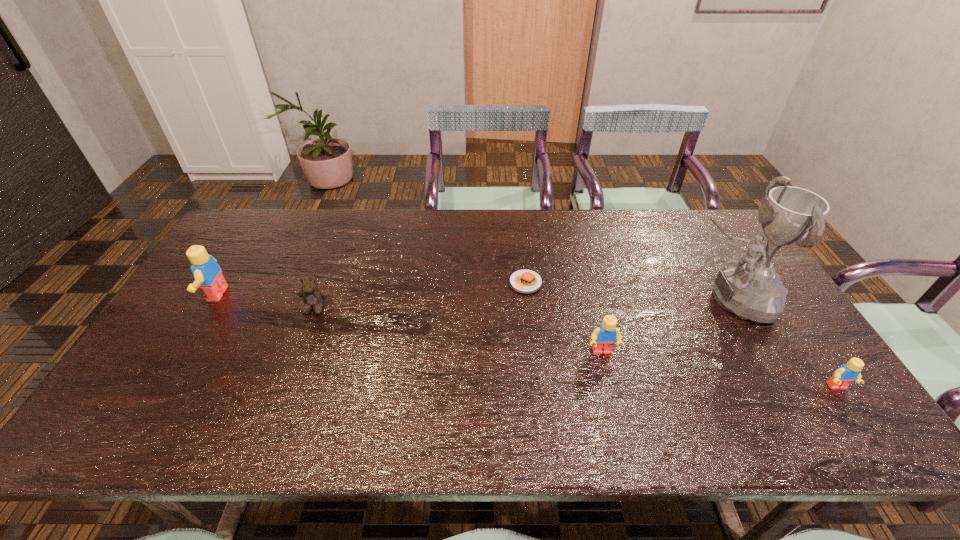
You are a GUI agent. You are given a task and a screenshot of the screen. Output one action in this format:
    pyautogui.click(x=<x>, y=<y>)
    Task: Click on the tallest Lego
    The height and width of the screenshot is (540, 960).
    Given the screenshot: What is the action you would take?
    pyautogui.click(x=208, y=275)

This screenshot has width=960, height=540. In order to click on the leftmost Lego in this screenshot , I will do `click(208, 275)`.

You are a GUI agent. You are given a task and a screenshot of the screen. Output one action in this format:
    pyautogui.click(x=<x>, y=<y>)
    Task: Click on the second farthest Lego
    
    Given the screenshot: What is the action you would take?
    pyautogui.click(x=604, y=337)

Image resolution: width=960 pixels, height=540 pixels. I want to click on the second tallest Lego, so click(x=604, y=337).

In order to click on the nearest object in this screenshot , I will do `click(844, 375)`.

The image size is (960, 540). In order to click on the shortest Lego in this screenshot , I will do `click(844, 375)`.

You are a GUI agent. You are given a task and a screenshot of the screen. Output one action in this format:
    pyautogui.click(x=<x>, y=<y>)
    Task: Click on the shortest object
    
    Given the screenshot: What is the action you would take?
    pyautogui.click(x=523, y=281)

This screenshot has width=960, height=540. Identify the location of food. (523, 281).

This screenshot has width=960, height=540. I want to click on the tallest object, so click(x=750, y=288).

The image size is (960, 540). What are the coordinates of `teddy bear` in the screenshot? It's located at click(x=313, y=296).